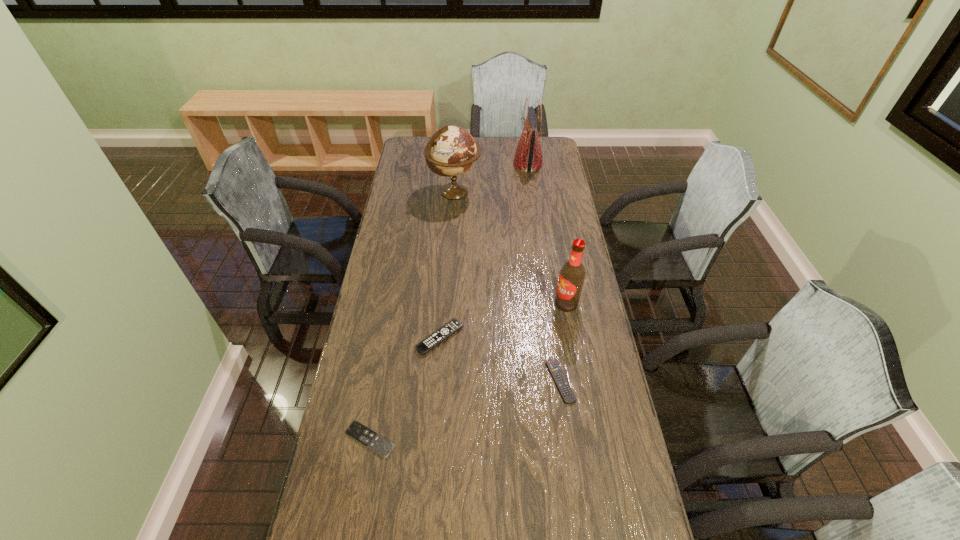
The width and height of the screenshot is (960, 540). I want to click on free space that satisfies the following two spatial constraints: 1. on the front of the fifth nearest object showing Asia; 2. on the front side of the fourth farthest object, so click(x=444, y=338).

Find the location of a particular element. The height and width of the screenshot is (540, 960). free space that satisfies the following two spatial constraints: 1. on the front of the globe showing Asia; 2. on the front side of the nearest object is located at coordinates (438, 440).

The height and width of the screenshot is (540, 960). I want to click on blank area in the image that satisfies the following two spatial constraints: 1. on the back side of the shortest remote control; 2. on the right side of the tallest remote control, so click(388, 338).

This screenshot has height=540, width=960. Identify the location of vacant area that satisfies the following two spatial constraints: 1. on the front of the third farthest object showing Asia; 2. on the left side of the fifth nearest object. (447, 303).

Identify the location of blank space that satisfies the following two spatial constraints: 1. on the front of the globe showing Asia; 2. on the front side of the leftmost remote control. (438, 440).

Find the location of a particular element. The image size is (960, 540). free space that satisfies the following two spatial constraints: 1. on the front of the globe showing Asia; 2. on the left side of the rightmost remote control is located at coordinates (442, 381).